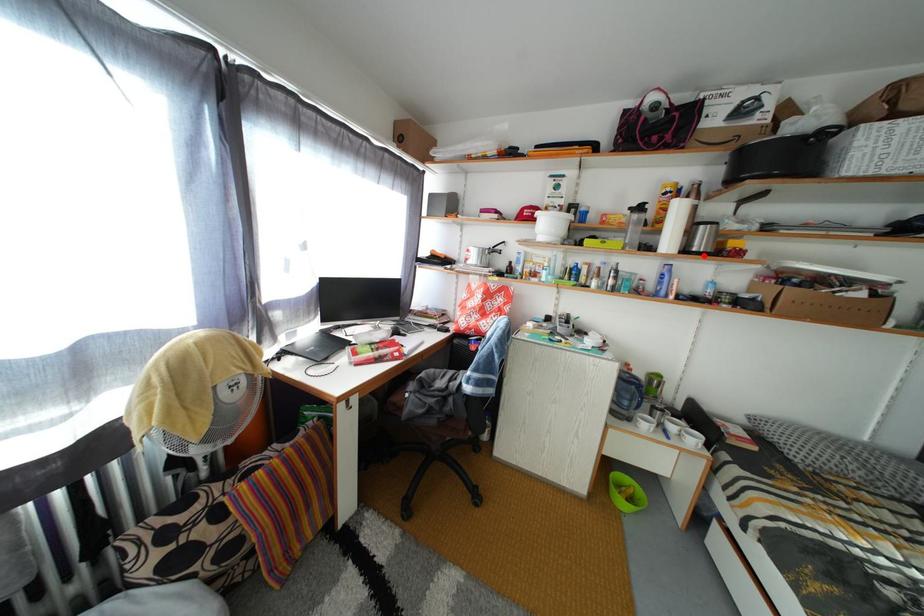
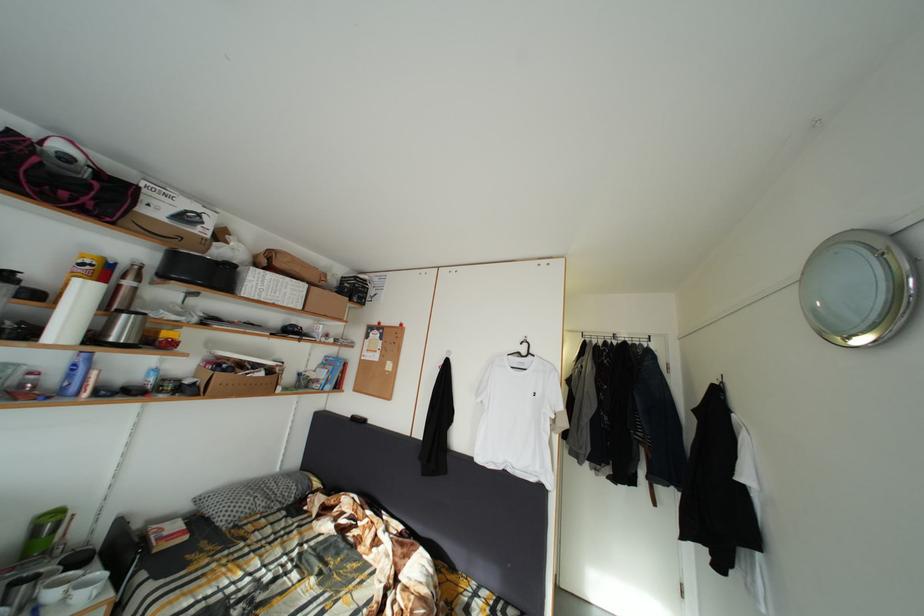
Question: I am providing you with two images of the same scene from different viewpoints. A red point is marked on the first image. Can you still see the location of the red point in image 2?

Choices:
 (A) Yes
 (B) No

Answer: (A)